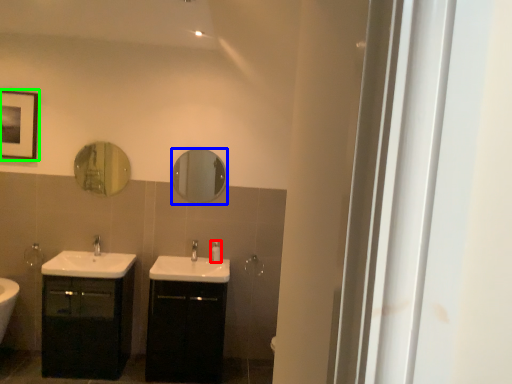
Question: Which object is the closest to the toiletry (highlighted by a red box)? Choose among these: mirror (highlighted by a blue box) or picture frame (highlighted by a green box).

Choices:
 (A) mirror
 (B) picture frame

Answer: (A)